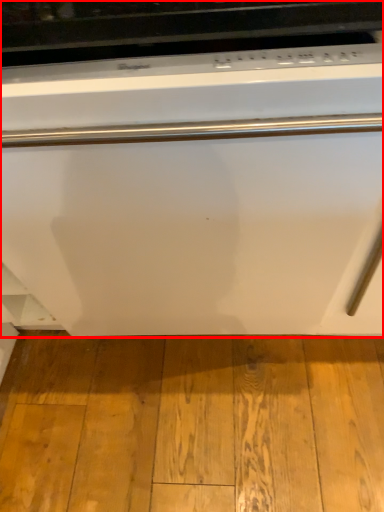
Question: Considering the relative positions of home appliance (annotated by the red box) and hardwood in the image provided, where is home appliance (annotated by the red box) located with respect to the staircase?

Choices:
 (A) left
 (B) right

Answer: (A)